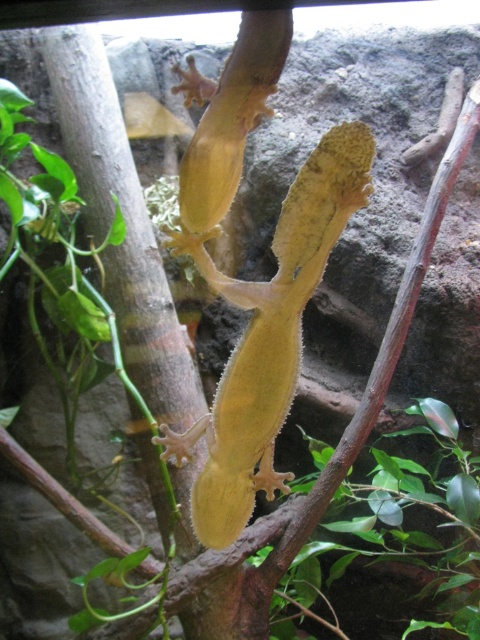
You are a researcher observing the gecko in its habitat. You notice both the yellow matte lizard at center and the green matte leaf at center. Which object has a smaller size?

The yellow matte lizard at center is smaller than the green matte leaf at center.